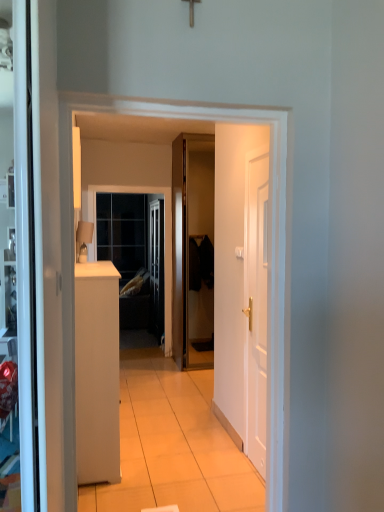
Question: From a real-world perspective, is clear glass window at center on matte beige lampshade at left?

Choices:
 (A) yes
 (B) no

Answer: (B)

Question: Considering the relative sizes of clear glass window at center and matte beige lampshade at left in the image provided, is clear glass window at center smaller than matte beige lampshade at left?

Choices:
 (A) yes
 (B) no

Answer: (B)

Question: Can you confirm if clear glass window at center is shorter than matte beige lampshade at left?

Choices:
 (A) yes
 (B) no

Answer: (B)

Question: Can you confirm if clear glass window at center is positioned to the left of matte beige lampshade at left?

Choices:
 (A) yes
 (B) no

Answer: (B)

Question: Is the depth of clear glass window at center greater than that of matte beige lampshade at left?

Choices:
 (A) yes
 (B) no

Answer: (A)

Question: Can you confirm if clear glass window at center is thinner than matte beige lampshade at left?

Choices:
 (A) no
 (B) yes

Answer: (B)

Question: Considering the relative sizes of white matte cabinet at left and clear glass window at center in the image provided, is white matte cabinet at left bigger than clear glass window at center?

Choices:
 (A) yes
 (B) no

Answer: (A)

Question: Is white matte cabinet at left next to clear glass window at center?

Choices:
 (A) yes
 (B) no

Answer: (B)

Question: Can you confirm if white matte cabinet at left is thinner than clear glass window at center?

Choices:
 (A) no
 (B) yes

Answer: (A)

Question: Considering the relative positions of white matte cabinet at left and clear glass window at center in the image provided, is white matte cabinet at left to the left of clear glass window at center from the viewer's perspective?

Choices:
 (A) no
 (B) yes

Answer: (B)

Question: Is white matte cabinet at left not inside clear glass window at center?

Choices:
 (A) yes
 (B) no

Answer: (A)

Question: From the image's perspective, is white matte cabinet at left above clear glass window at center?

Choices:
 (A) yes
 (B) no

Answer: (B)

Question: Is clear glass window at center further to camera compared to glossy wood door at center, the second door from the right?

Choices:
 (A) yes
 (B) no

Answer: (A)